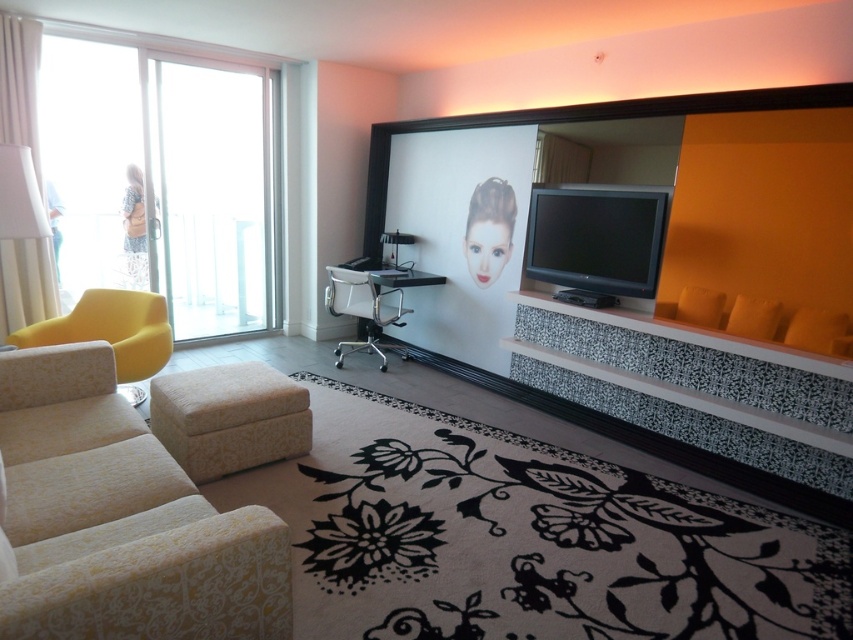
From the picture: You are planning to host a small gathering in the living room and need to accommodate 5 guests. The beige floral fabric couch at lower left and the white mesh office chair at center are available. Can these two pieces of furniture comfortably seat all 5 guests?

The beige floral fabric couch at lower left has a larger size compared to the white mesh office chair at center. However, the couch and chair combined can only seat about 3 people, so they cannot comfortably accommodate 5 guests.

Looking at this image, you are standing in the living room and want to move to the balcony door. The yellow fabric chair at left is in your way. Can you walk around it? Please explain.

The yellow fabric chair at left is located at point (111, 332). Since you need to reach the balcony door, you can walk around it either to the left or right side of the chair to proceed.